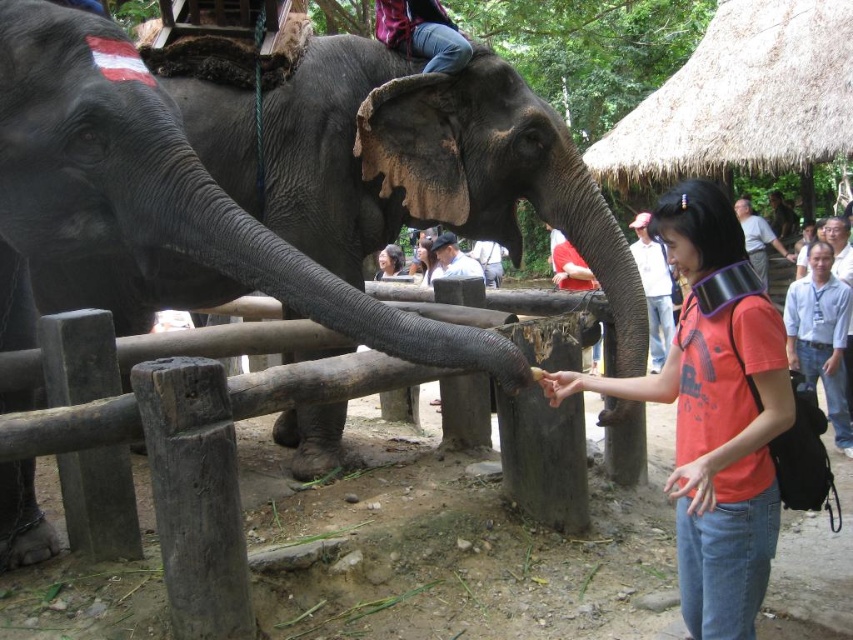
You are standing at the point marked by coordinates point (13,109) and want to approach the elephants safely. The sanctuary requires a minimum distance of 7 feet between visitors and elephants. Can you safely move closer to the elephants from your current position?

You are currently 6.91 feet away from the elephants, which is less than the required 7 feet minimum distance. Therefore, you cannot move closer and must stay at least 7 feet away.